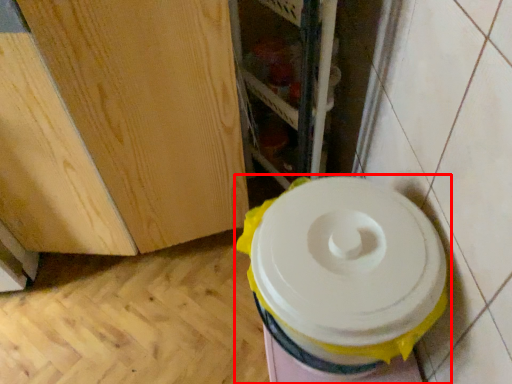
Question: Observing the image, what is the correct spatial positioning of toilet (annotated by the red box) in reference to shelf?

Choices:
 (A) right
 (B) left

Answer: (A)